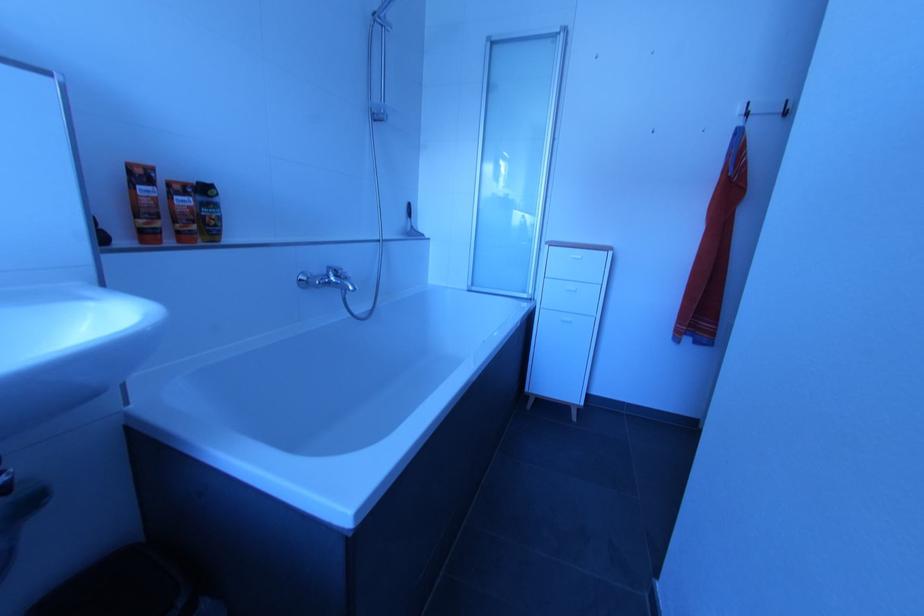
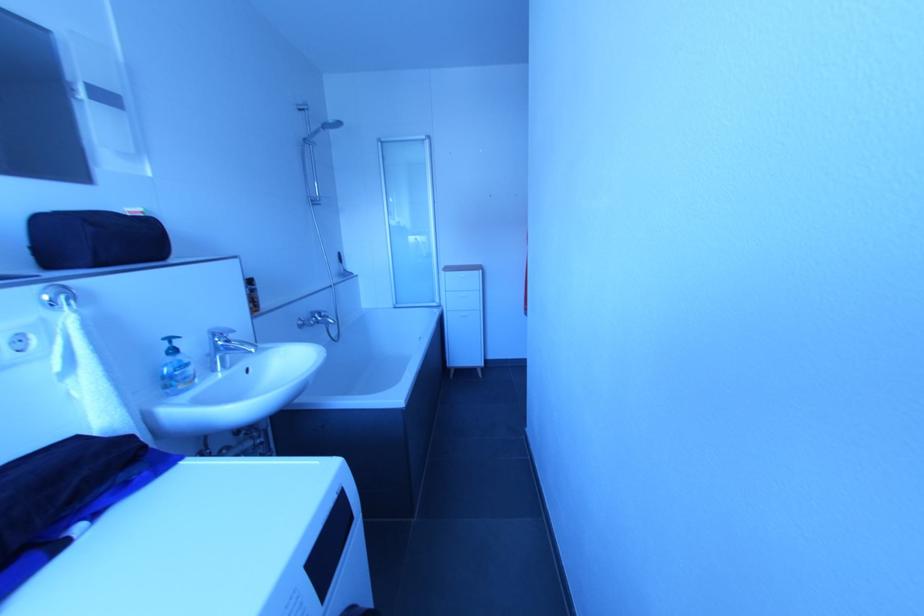
Question: How did the camera likely rotate?

Choices:
 (A) Left
 (B) Right
 (C) Up
 (D) Down

Answer: (B)